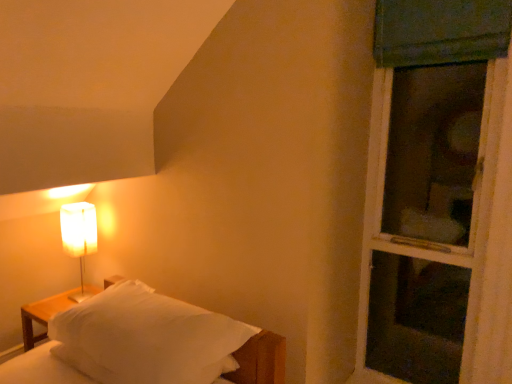
Question: Does white paper lampshade at left have a larger size compared to white soft bed at lower left?

Choices:
 (A) no
 (B) yes

Answer: (A)

Question: Is white paper lampshade at left positioned with its back to white soft bed at lower left?

Choices:
 (A) yes
 (B) no

Answer: (B)

Question: Is white paper lampshade at left behind white soft bed at lower left?

Choices:
 (A) no
 (B) yes

Answer: (B)

Question: Are white paper lampshade at left and white soft bed at lower left located far from each other?

Choices:
 (A) yes
 (B) no

Answer: (B)

Question: Is the surface of white paper lampshade at left in direct contact with white soft bed at lower left?

Choices:
 (A) no
 (B) yes

Answer: (A)

Question: Considering the positions of white paper lampshade at left and white soft bed at lower left in the image, is white paper lampshade at left bigger or smaller than white soft bed at lower left?

Choices:
 (A) small
 (B) big

Answer: (A)

Question: From a real-world perspective, is white paper lampshade at left positioned above or below white soft bed at lower left?

Choices:
 (A) above
 (B) below

Answer: (A)

Question: Is white paper lampshade at left situated inside white soft bed at lower left or outside?

Choices:
 (A) outside
 (B) inside

Answer: (A)

Question: In the image, is white paper lampshade at left on the left side or the right side of white soft bed at lower left?

Choices:
 (A) right
 (B) left

Answer: (B)

Question: Considering the positions of white paper lampshade at left and green fabric screen door at right in the image, is white paper lampshade at left wider or thinner than green fabric screen door at right?

Choices:
 (A) wide
 (B) thin

Answer: (B)

Question: Considering the positions of white paper lampshade at left and green fabric screen door at right in the image, is white paper lampshade at left taller or shorter than green fabric screen door at right?

Choices:
 (A) short
 (B) tall

Answer: (A)

Question: Does point (94, 238) appear closer or farther from the camera than point (422, 92)?

Choices:
 (A) farther
 (B) closer

Answer: (A)

Question: In the image, is white paper lampshade at left on the left side or the right side of green fabric screen door at right?

Choices:
 (A) left
 (B) right

Answer: (A)

Question: Is green fabric screen door at right to the left or to the right of white soft bed at lower left in the image?

Choices:
 (A) right
 (B) left

Answer: (A)

Question: Relative to white soft bed at lower left, is green fabric screen door at right in front or behind?

Choices:
 (A) behind
 (B) front

Answer: (A)